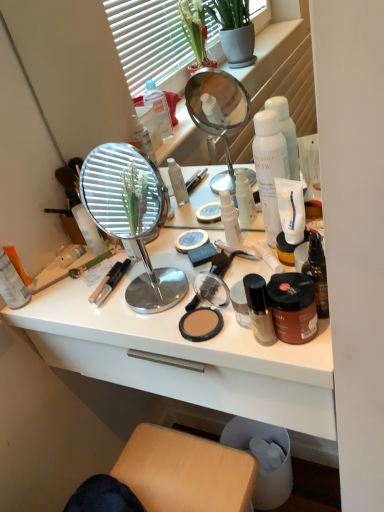
Locate an element on the screen. Image resolution: width=384 pixels, height=512 pixels. vacant space positioned to the left of shiny brown bottle at right, which is the 1th toiletry in right-to-left order is located at coordinates (211, 329).